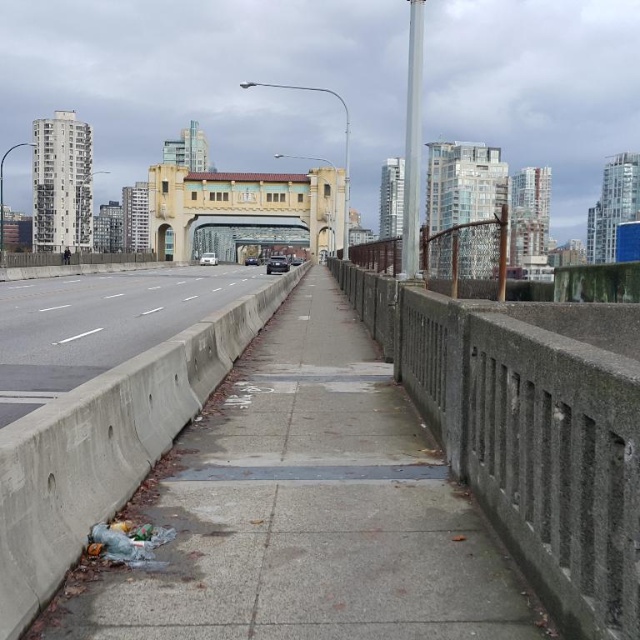
Question: Which point is farther from the camera taking this photo?

Choices:
 (A) (x=52, y=300)
 (B) (x=184, y=236)

Answer: (B)

Question: Does gray concrete pavement at center have a greater width compared to concrete at center?

Choices:
 (A) yes
 (B) no

Answer: (B)

Question: Where is gray concrete pavement at center located in relation to golden textured bridge at center in the image?

Choices:
 (A) below
 (B) above

Answer: (A)

Question: Is gray concrete pavement at center to the left of concrete at center from the viewer's perspective?

Choices:
 (A) no
 (B) yes

Answer: (A)

Question: Which of these objects is positioned farthest from the gray concrete pavement at center?

Choices:
 (A) concrete at center
 (B) golden textured bridge at center

Answer: (B)

Question: Among these points, which one is nearest to the camera?

Choices:
 (A) (244, 179)
 (B) (218, 609)
 (C) (64, 300)

Answer: (B)